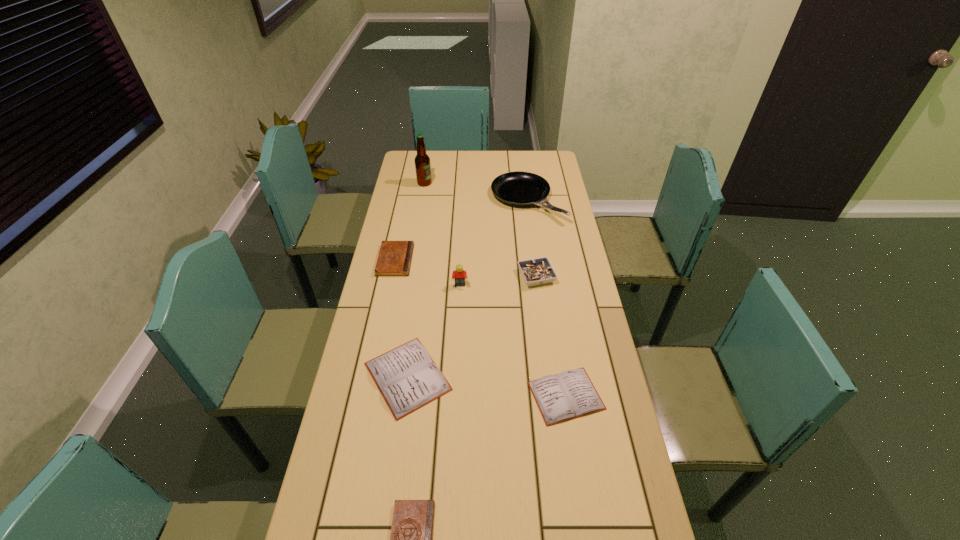
Locate an element on the screen. beer bottle is located at coordinates (422, 161).

At what (x,y) coordinates should I click in order to perform the action: click on brown beer bottle. Please return your answer as a coordinate pair (x, y). The width and height of the screenshot is (960, 540). Looking at the image, I should click on (422, 161).

Where is `the second tallest object`? This screenshot has width=960, height=540. the second tallest object is located at coordinates (460, 275).

In order to click on the sixth shortest object in this screenshot , I will do `click(519, 188)`.

Locate an element on the screen. The image size is (960, 540). black pan is located at coordinates (519, 188).

Where is `gray ashtray`? gray ashtray is located at coordinates (539, 271).

Find the location of `ashtray`. ashtray is located at coordinates (539, 271).

The image size is (960, 540). I want to click on the bigger white diary, so click(408, 379).

Where is `the farthest diary`? This screenshot has height=540, width=960. the farthest diary is located at coordinates (394, 259).

The height and width of the screenshot is (540, 960). Identify the location of the left brown diary. (394, 259).